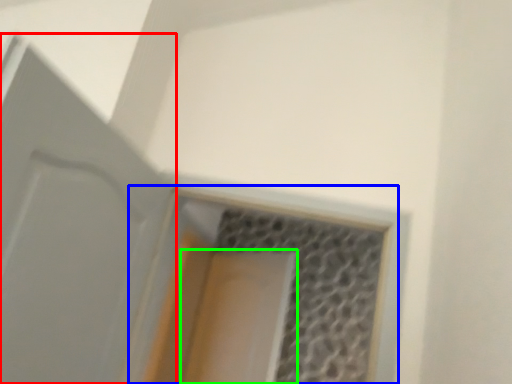
Question: Which is farther away from door (highlighted by a red box)? window (highlighted by a blue box) or screen door (highlighted by a green box)?

Choices:
 (A) window
 (B) screen door

Answer: (B)